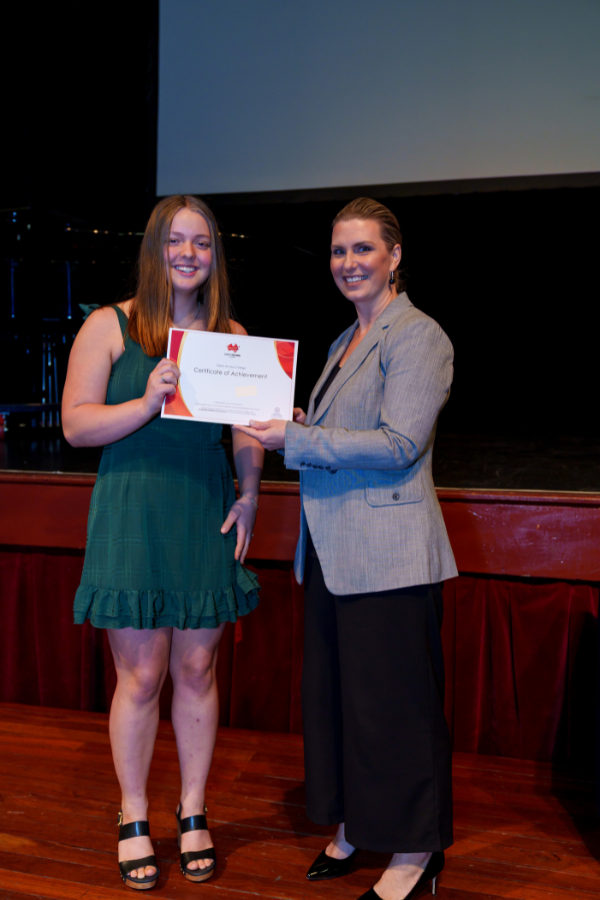
This screenshot has height=900, width=600. I want to click on curtain, so click(481, 406), click(523, 610).